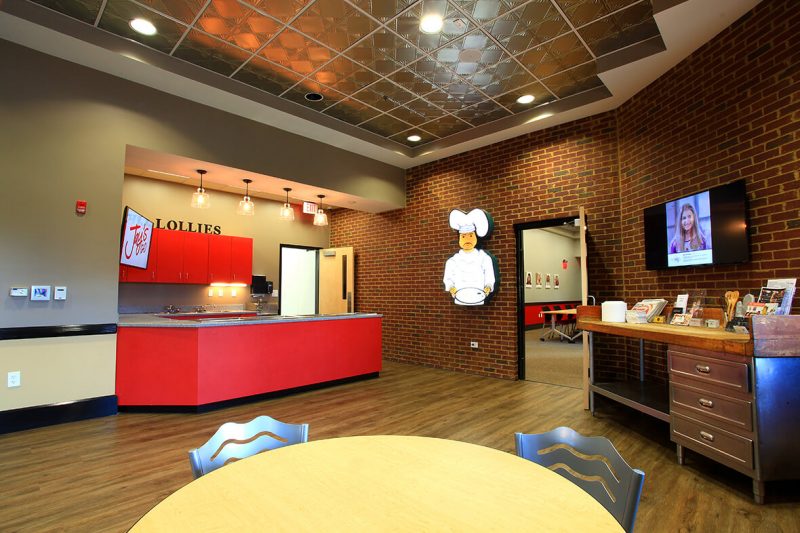
Where is `tv`? The image size is (800, 533). tv is located at coordinates (710, 245), (156, 250).